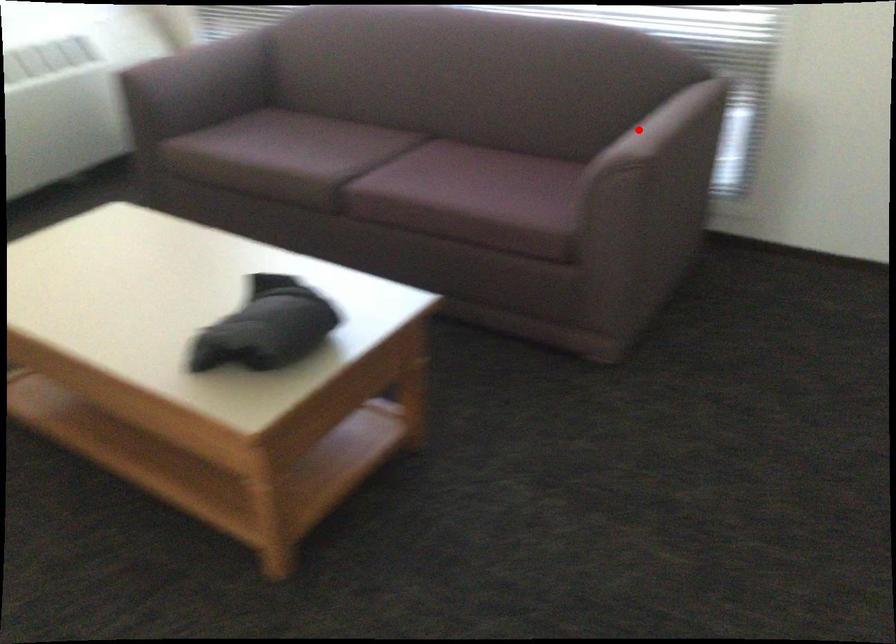
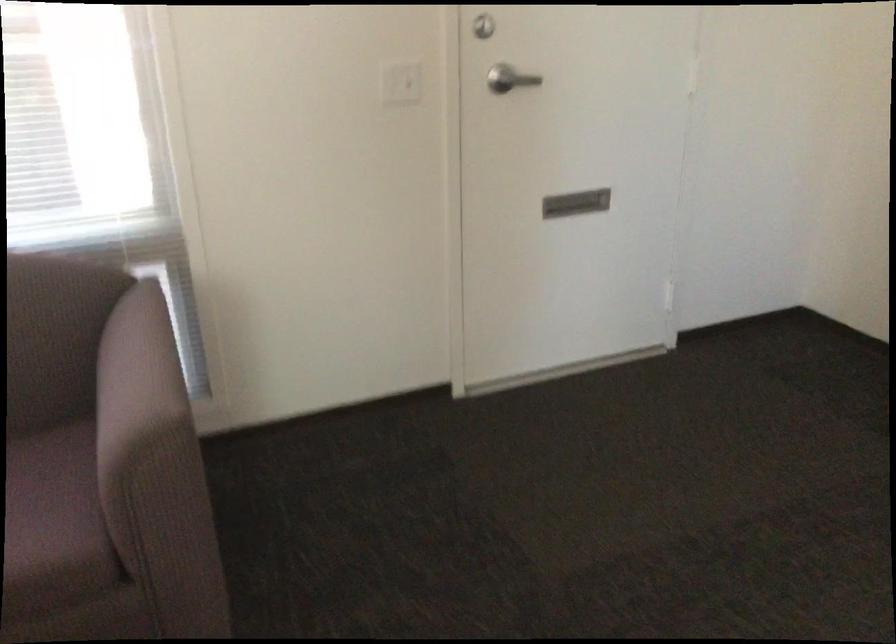
Question: A red point is marked in image1. In image2, is the corresponding 3D point closer to the camera or farther? Reply with the corresponding letter.

Choices:
 (A) The corresponding 3D point is closer.
 (B) The corresponding 3D point is farther.

Answer: (A)